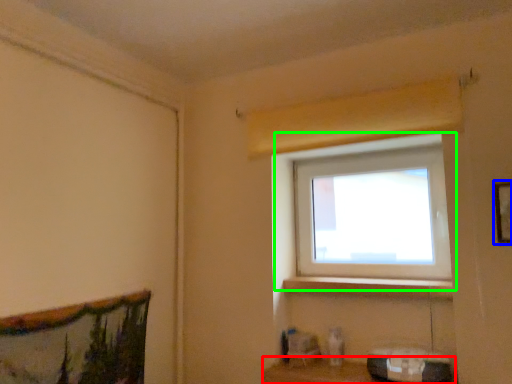
Question: Which object is positioned farthest from shelf (highlighted by a red box)? Select from picture frame (highlighted by a blue box) and window (highlighted by a green box).

Choices:
 (A) picture frame
 (B) window

Answer: (A)